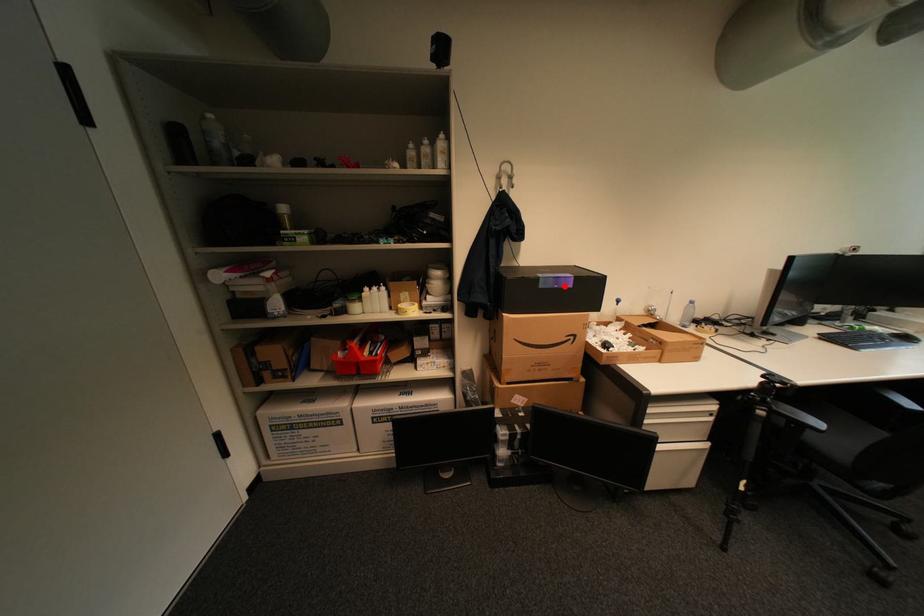
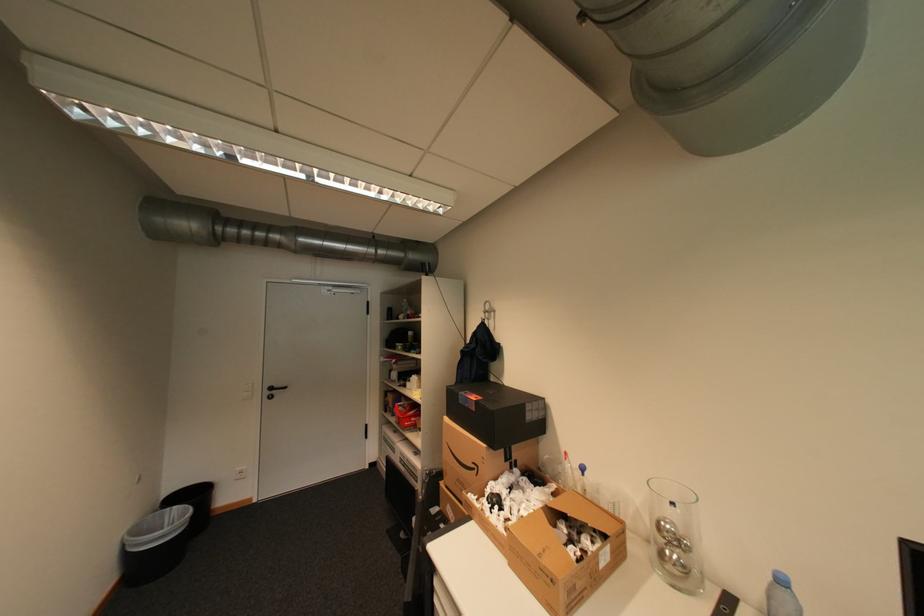
Find the pixel in the second image that matches the highlighted location in the first image.

(476, 406)